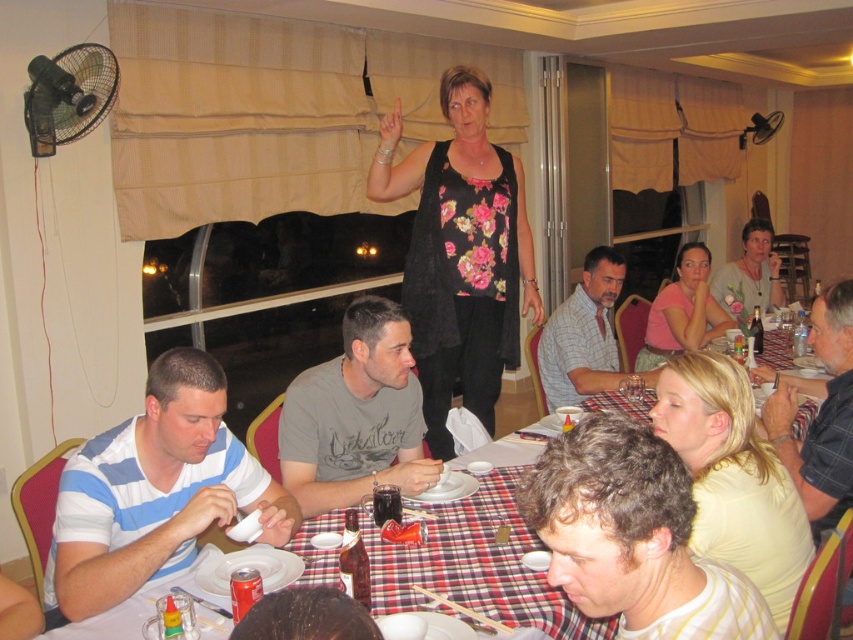
You are a photographer taking a group photo of the people at the table. You notice two shirts at the center of the image, a plaid shirt at center and a checkered fabric shirt at center. Which shirt should you focus on to ensure it is fully visible in the photo?

The plaid shirt at center is shorter than checkered fabric shirt at center, so focusing on the checkered fabric shirt at center would ensure it is fully visible since it is taller.

You are sitting at the table in the scene and want to hand a napkin to the person wearing the blue striped shirt at lower left. If you can reach 5 feet, will you be able to reach them without moving from your seat?

The blue striped shirt at lower left and viewer are 5.17 feet apart. Since your reach is 5 feet, you cannot quite reach them without moving from your seat.

You are a guest at the dinner party and want to identify the two shirts at the center of the table. Which shirt is positioned lower between the plaid shirt at center and the checkered fabric shirt at center?

The plaid shirt at center is located below the checkered fabric shirt at center, so it is positioned lower.